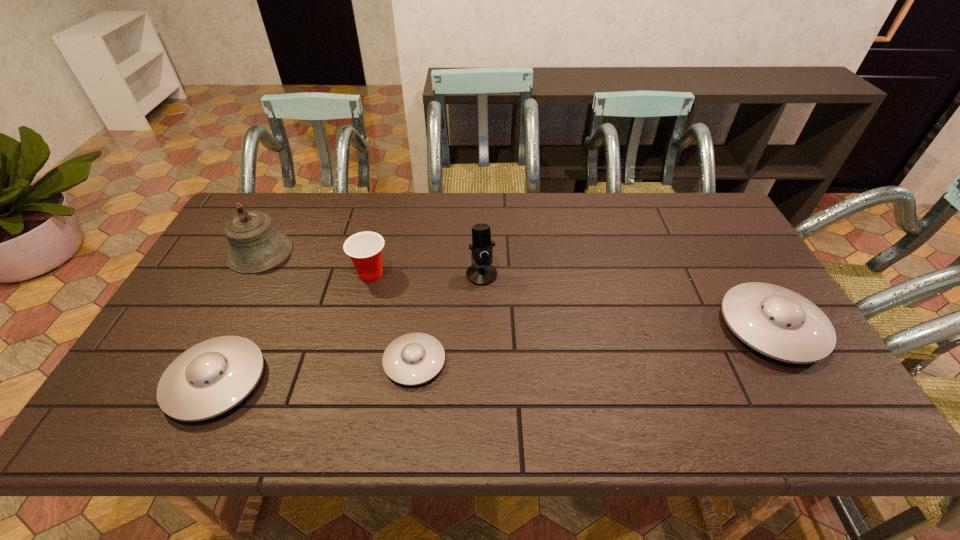
Please determine a free point for an extra saucer to ensure balance. Please provide its 2D coordinates. Your answer should be formatted as a tuple, i.e. [(x, y)], where the tuple contains the x and y coordinates of a point satisfying the conditions above.

[(599, 343)]